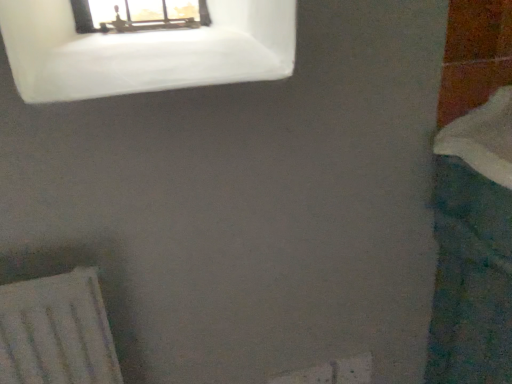
Question: Is teal fabric bath at right oriented towards white frosted glass window at upper left?

Choices:
 (A) no
 (B) yes

Answer: (A)

Question: From the image's perspective, does teal fabric bath at right appear higher than white frosted glass window at upper left?

Choices:
 (A) yes
 (B) no

Answer: (B)

Question: Considering the relative sizes of teal fabric bath at right and white frosted glass window at upper left in the image provided, is teal fabric bath at right smaller than white frosted glass window at upper left?

Choices:
 (A) no
 (B) yes

Answer: (A)

Question: Is teal fabric bath at right outside of white frosted glass window at upper left?

Choices:
 (A) no
 (B) yes

Answer: (B)

Question: Is the depth of teal fabric bath at right greater than that of white frosted glass window at upper left?

Choices:
 (A) no
 (B) yes

Answer: (A)

Question: Considering the relative sizes of teal fabric bath at right and white frosted glass window at upper left in the image provided, is teal fabric bath at right bigger than white frosted glass window at upper left?

Choices:
 (A) yes
 (B) no

Answer: (A)

Question: Is white frosted glass window at upper left to the right of teal fabric bath at right from the viewer's perspective?

Choices:
 (A) yes
 (B) no

Answer: (B)

Question: From the image's perspective, is white frosted glass window at upper left below teal fabric bath at right?

Choices:
 (A) no
 (B) yes

Answer: (A)

Question: Can you confirm if white frosted glass window at upper left is smaller than teal fabric bath at right?

Choices:
 (A) no
 (B) yes

Answer: (B)

Question: Is white frosted glass window at upper left not inside teal fabric bath at right?

Choices:
 (A) no
 (B) yes

Answer: (B)

Question: Considering the relative sizes of white frosted glass window at upper left and teal fabric bath at right in the image provided, is white frosted glass window at upper left bigger than teal fabric bath at right?

Choices:
 (A) yes
 (B) no

Answer: (B)

Question: Does white frosted glass window at upper left lie behind teal fabric bath at right?

Choices:
 (A) no
 (B) yes

Answer: (B)

Question: From the image's perspective, relative to white frosted glass window at upper left, is teal fabric bath at right above or below?

Choices:
 (A) above
 (B) below

Answer: (B)